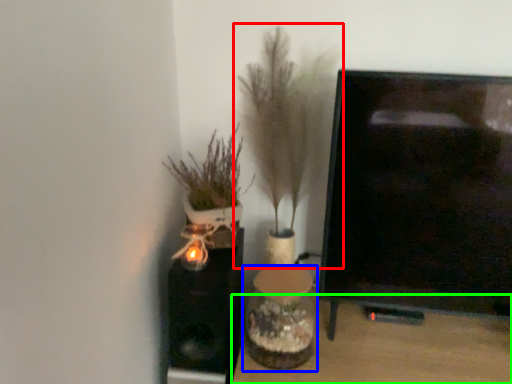
Question: Considering the real-world distances, which object is closest to houseplant (highlighted by a red box)? vase (highlighted by a blue box) or furniture (highlighted by a green box).

Choices:
 (A) vase
 (B) furniture

Answer: (A)